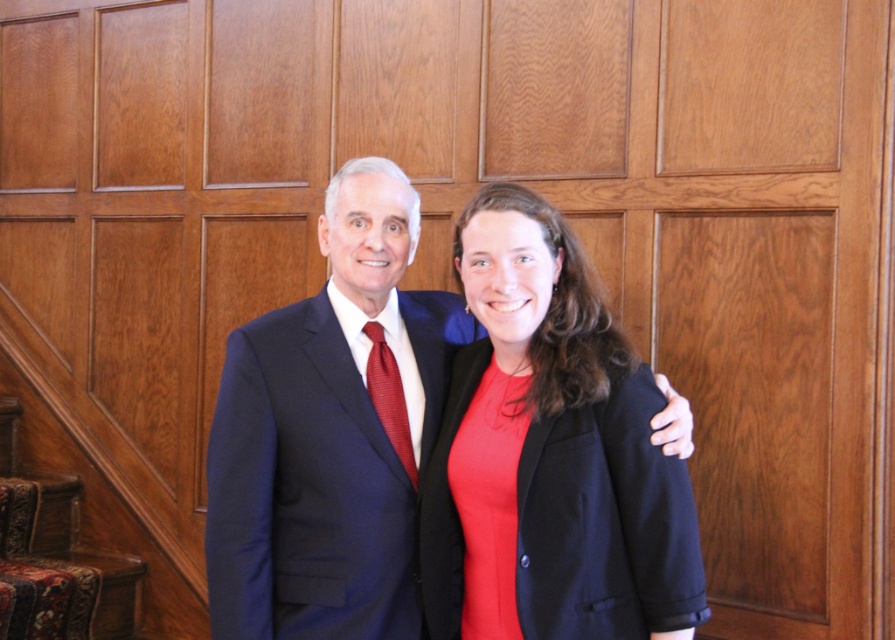
You are standing in the scene and want to walk towards the point that is closer to the camera. Which point should you walk towards, point (493, 573) or point (394, 310)?

You should walk towards point (493, 573) because it is in front of point (394, 310), making it closer to the camera.

You are a photographer adjusting your camera settings to focus on the two individuals in the scene. Since both the matte black blazer at center and the matte black suit at center are dark, you need to ensure proper exposure. Which one should you focus on to account for their positions?

The matte black blazer at center is in front of the matte black suit at center, so focusing on the matte black blazer at center would ensure proper exposure since it is closer to the camera.